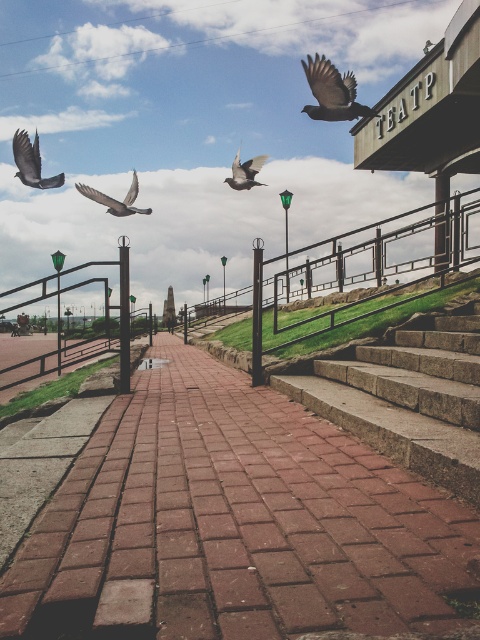
You are standing at the base of the stone steps on the right side of the brick pathway. You want to throw a pebble to hit the gray matte pigeon at upper left. Will the pebble land on the brick pavement at center before reaching the pigeon?

The brick pavement at center is located below the gray matte pigeon at upper left, so the pebble would hit the pigeon before reaching the brick pavement at center.

You are a maintenance worker needing to reach the matte gray bird at center from the brick pavement at center. Given that your equipment can only move 50 feet, can you safely reach the bird without exceeding the equipment range?

The distance between the brick pavement at center and the matte gray bird at center is 53.72 feet, which exceeds the equipment range of 50 feet. Therefore, you cannot safely reach the bird without exceeding the equipment range.

You are a birdwatcher observing the scene. You see a matte black bird at upper right and a matte gray bird at center. Which bird is positioned higher in the sky?

The matte black bird at upper right is positioned higher in the sky than the matte gray bird at center.